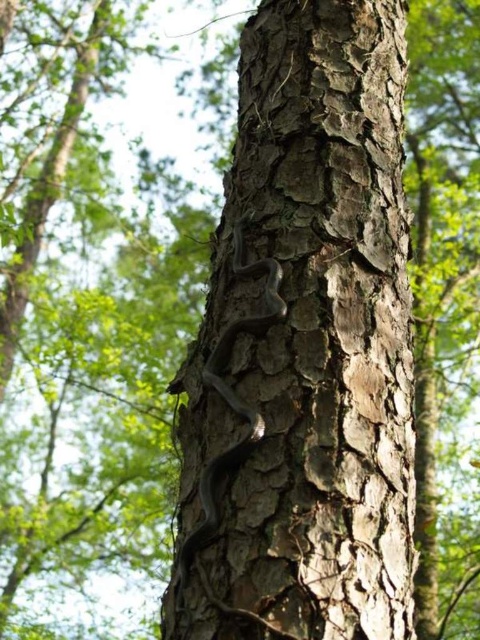
Who is positioned more to the right, smooth bark tree trunk at center or shiny black snake at center?

From the viewer's perspective, smooth bark tree trunk at center appears more on the right side.

Is smooth bark tree trunk at center shorter than shiny black snake at center?

No.

Between point (334, 269) and point (223, 380), which one is positioned in front?

Point (223, 380) is more forward.

Locate an element on the screen. The image size is (480, 640). smooth bark tree trunk at center is located at coordinates (308, 342).